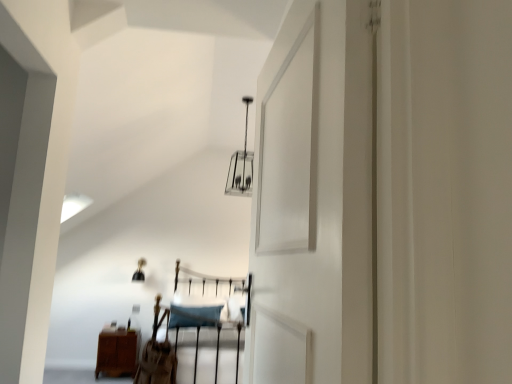
Question: Considering the positions of brown wood nightstand at lower left and brown leather chair at center in the image, is brown wood nightstand at lower left bigger or smaller than brown leather chair at center?

Choices:
 (A) small
 (B) big

Answer: (B)

Question: From the image's perspective, relative to brown leather chair at center, is brown wood nightstand at lower left above or below?

Choices:
 (A) below
 (B) above

Answer: (A)

Question: Estimate the real-world distances between objects in this image. Which object is farther from the metallic silver light fixture at upper center?

Choices:
 (A) brown leather chair at center
 (B) brown wood nightstand at lower left

Answer: (B)

Question: Which of these objects is positioned closest to the brown leather chair at center?

Choices:
 (A) brown wood nightstand at lower left
 (B) metallic silver light fixture at upper center

Answer: (A)